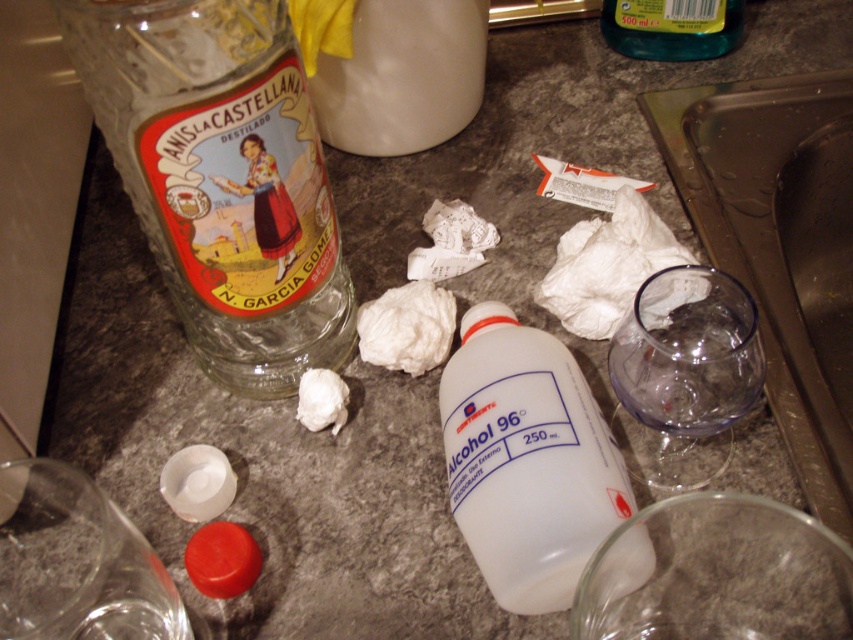
Question: Which object is positioned closest to the white plastic bottle at center?

Choices:
 (A) white fabric at center
 (B) white crumpled paper at center
 (C) transparent glass bottle at upper left

Answer: (A)

Question: Can you confirm if white crumpled paper at center is positioned to the left of green translucent bottle at upper right?

Choices:
 (A) yes
 (B) no

Answer: (A)

Question: Is transparent glass bottle at upper left further to camera compared to green translucent bottle at upper right?

Choices:
 (A) yes
 (B) no

Answer: (B)

Question: Which point is closer to the camera?

Choices:
 (A) white fabric at center
 (B) white plastic bottle at center

Answer: (B)

Question: Which point is closer to the camera taking this photo?

Choices:
 (A) (433, 305)
 (B) (703, 49)
 (C) (306, 161)
 (D) (669, 259)

Answer: (C)

Question: Does transparent glass bottle at upper left come behind white crumpled paper at center?

Choices:
 (A) no
 (B) yes

Answer: (A)